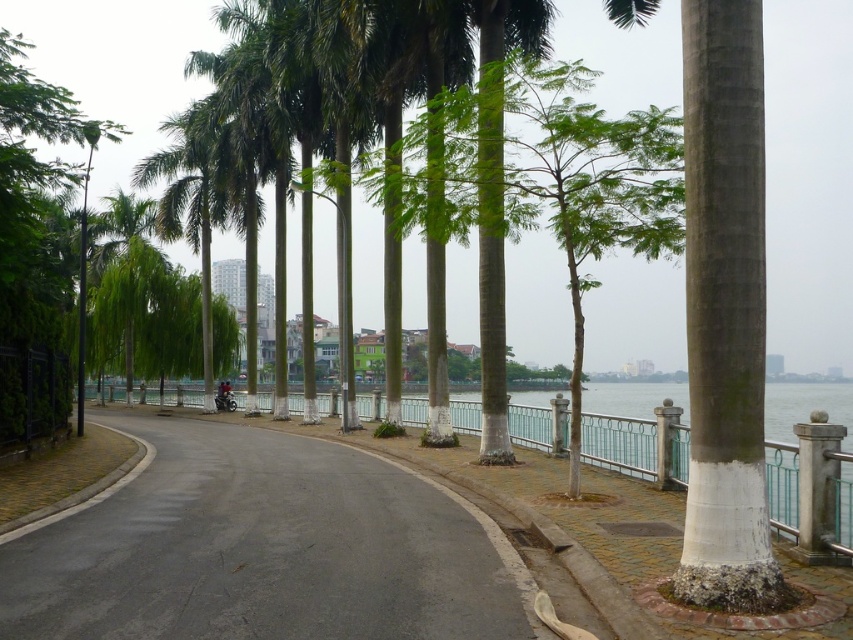
Question: Can you confirm if black asphalt road at center is positioned to the left of white painted concrete pillar at right?

Choices:
 (A) no
 (B) yes

Answer: (B)

Question: Considering the relative positions of black asphalt road at center and white painted concrete pillar at right in the image provided, where is black asphalt road at center located with respect to white painted concrete pillar at right?

Choices:
 (A) right
 (B) left

Answer: (B)

Question: Estimate the real-world distances between objects in this image. Which object is closer to the black asphalt road at center?

Choices:
 (A) white concrete pillar at right
 (B) white painted concrete pillar at right

Answer: (A)

Question: Is black asphalt road at center below white painted concrete pillar at right?

Choices:
 (A) yes
 (B) no

Answer: (A)

Question: Which object is closer to the camera taking this photo?

Choices:
 (A) black asphalt road at center
 (B) white concrete pillar at right
 (C) white painted concrete pillar at right

Answer: (A)

Question: Among these objects, which one is nearest to the camera?

Choices:
 (A) white painted concrete pillar at right
 (B) black asphalt road at center
 (C) white concrete pillar at right

Answer: (B)